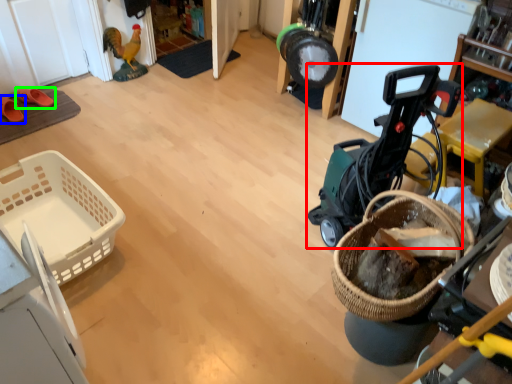
Question: Which is farther away from baby carriage (highlighted by a red box)? footwear (highlighted by a blue box) or footwear (highlighted by a green box)?

Choices:
 (A) footwear
 (B) footwear

Answer: (A)